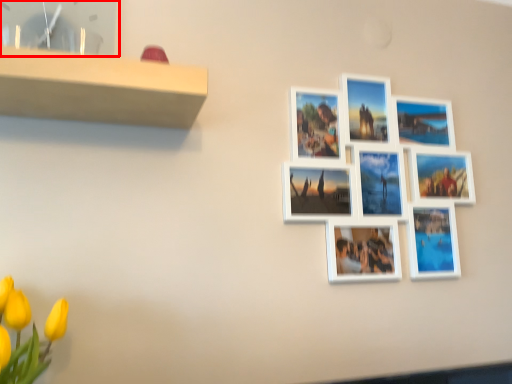
Question: From the image, what is the correct spatial relationship of picture frame (annotated by the red box) in relation to picture frame?

Choices:
 (A) right
 (B) left

Answer: (B)